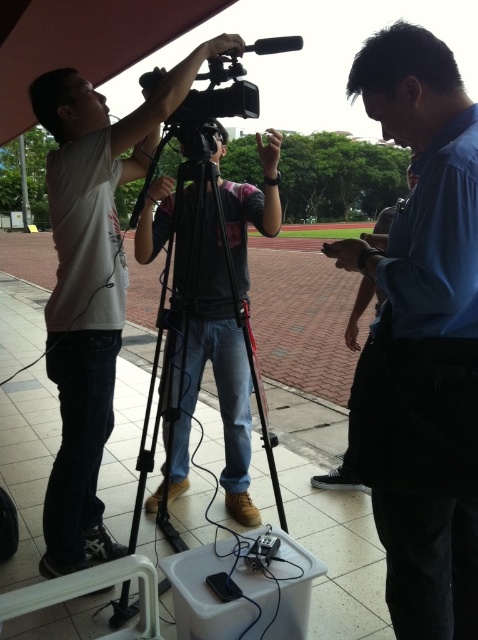
Is matte white shirt at upper left shorter than black matte tripod at center?

No.

Between point (95, 109) and point (136, 500), which one is positioned behind?

Point (136, 500)

The image size is (478, 640). In order to click on matte white shirt at upper left in this screenshot , I will do [91, 284].

The width and height of the screenshot is (478, 640). What do you see at coordinates (421, 340) in the screenshot?
I see `blue shirt at center` at bounding box center [421, 340].

The image size is (478, 640). What do you see at coordinates (421, 340) in the screenshot?
I see `blue shirt at center` at bounding box center [421, 340].

Image resolution: width=478 pixels, height=640 pixels. I want to click on blue shirt at center, so click(421, 340).

Does blue shirt at center appear on the right side of black matte tripod at center?

Indeed, blue shirt at center is positioned on the right side of black matte tripod at center.

Which is in front, point (473, 349) or point (226, 417)?

Positioned in front is point (473, 349).

Measure the distance between point (444, 330) and camera.

A distance of 1.21 meters exists between point (444, 330) and camera.

At what (x,y) coordinates should I click in order to perform the action: click on blue shirt at center. Please return your answer as a coordinate pair (x, y). Looking at the image, I should click on (421, 340).